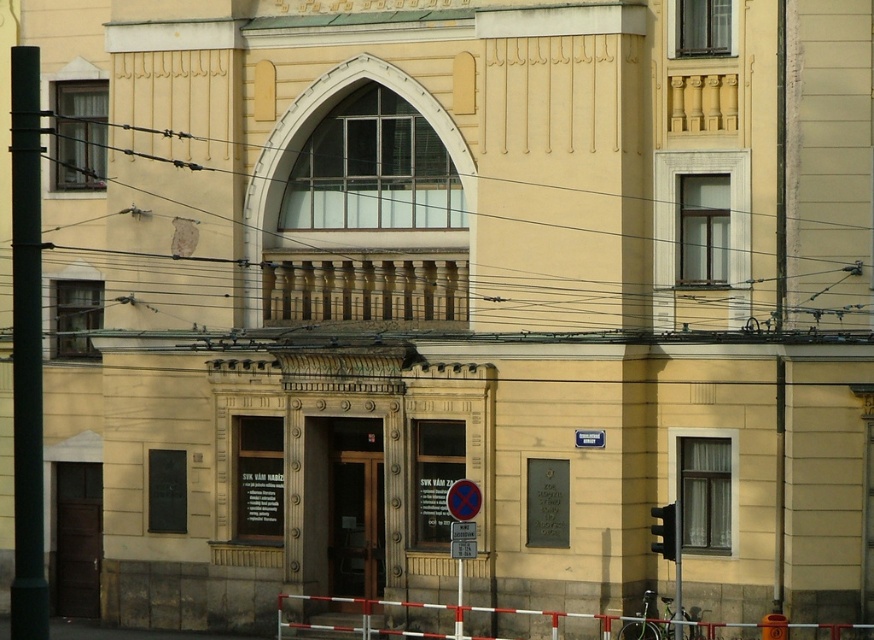
Question: Among these objects, which one is farthest from the camera?

Choices:
 (A) metallic circular sign at center
 (B) white/red plastic barrier at lower center

Answer: (B)

Question: Can you confirm if brown wooden door at center is wider than brown wooden door at lower left?

Choices:
 (A) yes
 (B) no

Answer: (A)

Question: Is brown wooden door at center above brown wooden door at lower left?

Choices:
 (A) yes
 (B) no

Answer: (A)

Question: Does brown wooden door at center have a greater width compared to metallic circular sign at center?

Choices:
 (A) yes
 (B) no

Answer: (A)

Question: Which object appears farthest from the camera in this image?

Choices:
 (A) metallic rectangular sign at center
 (B) metallic circular sign at center
 (C) brown wooden door at lower left

Answer: (C)

Question: Which object appears farthest from the camera in this image?

Choices:
 (A) metallic rectangular sign at center
 (B) metallic circular sign at center
 (C) white/red plastic barrier at lower center
 (D) brown wooden door at center

Answer: (D)